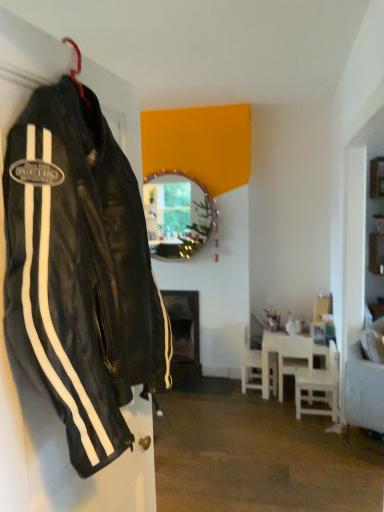
Question: Can we say white wooden table at lower right lies outside white plastic chair at lower right, arranged as the third chair when viewed from the back?

Choices:
 (A) yes
 (B) no

Answer: (A)

Question: From a real-world perspective, does white wooden table at lower right stand above white plastic chair at lower right, arranged as the third chair when viewed from the back?

Choices:
 (A) yes
 (B) no

Answer: (B)

Question: Does white wooden table at lower right have a greater width compared to white plastic chair at lower right, arranged as the third chair when viewed from the back?

Choices:
 (A) no
 (B) yes

Answer: (B)

Question: Is white wooden table at lower right to the left of white plastic chair at lower right, arranged as the third chair when viewed from the back, from the viewer's perspective?

Choices:
 (A) yes
 (B) no

Answer: (A)

Question: Considering the relative sizes of white wooden table at lower right and white plastic chair at lower right, arranged as the third chair when viewed from the back, in the image provided, is white wooden table at lower right smaller than white plastic chair at lower right, arranged as the third chair when viewed from the back,?

Choices:
 (A) no
 (B) yes

Answer: (A)

Question: Is white wooden table at lower right further to camera compared to white plastic chair at lower right, which appears as the first chair when viewed from the front?

Choices:
 (A) no
 (B) yes

Answer: (B)

Question: From a real-world perspective, is white wooden chair at lower right, positioned as the 2th chair in back-to-front order, below white plastic chair at lower right, which appears as the first chair when viewed from the front?

Choices:
 (A) no
 (B) yes

Answer: (A)

Question: Are white wooden chair at lower right, which is the second chair in front-to-back order, and white plastic chair at lower right, which appears as the first chair when viewed from the front, far apart?

Choices:
 (A) no
 (B) yes

Answer: (A)

Question: Does white wooden chair at lower right, positioned as the 2th chair in back-to-front order, have a lesser height compared to white plastic chair at lower right, arranged as the third chair when viewed from the back?

Choices:
 (A) yes
 (B) no

Answer: (B)

Question: Does white wooden chair at lower right, which is the second chair in front-to-back order, have a lesser width compared to white plastic chair at lower right, which appears as the first chair when viewed from the front?

Choices:
 (A) no
 (B) yes

Answer: (B)

Question: Is white wooden chair at lower right, which is the second chair in front-to-back order, to the left of white plastic chair at lower right, which appears as the first chair when viewed from the front, from the viewer's perspective?

Choices:
 (A) yes
 (B) no

Answer: (A)

Question: Are white wooden chair at lower right, positioned as the 2th chair in back-to-front order, and white plastic chair at lower right, arranged as the third chair when viewed from the back, making contact?

Choices:
 (A) yes
 (B) no

Answer: (B)

Question: Is the position of white wooden table at lower right more distant than that of white plastic chair at lower right, arranged as the 1th chair when viewed from the back?

Choices:
 (A) yes
 (B) no

Answer: (B)